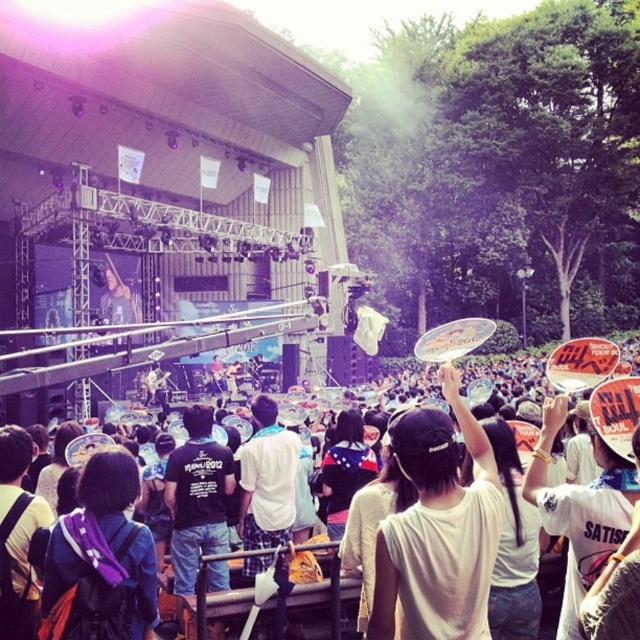
In the scene shown: Based on the scene description, where is the white cotton shirt at center located in terms of coordinates?

The white cotton shirt at center is located at coordinates point (268, 480).

You are standing at the concert venue and want to reach the purple fabric backpack at center. The venue has a rule that you can only move forward in straight lines and cannot detour around obstacles. Given that the shortest path to the backpack is 96.73 feet, is there any obstacle between you and the backpack that you need to navigate around?

The distance between you and the purple fabric backpack at center is 96.73 feet. Since the shortest path is exactly that distance, there are no obstacles blocking your direct path to the backpack. You can move straight ahead without needing to detour.